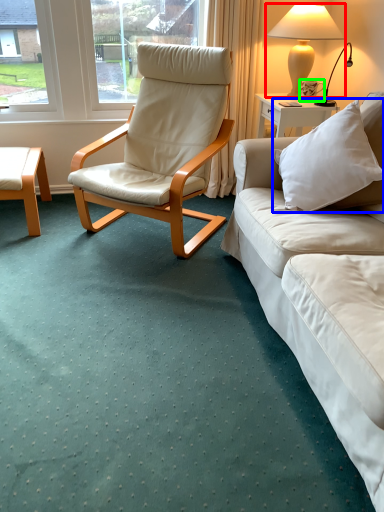
Question: Estimate the real-world distances between objects in this image. Which object is closer to lamp (highlighted by a red box), pillow (highlighted by a blue box) or coffee cup (highlighted by a green box)?

Choices:
 (A) pillow
 (B) coffee cup

Answer: (B)